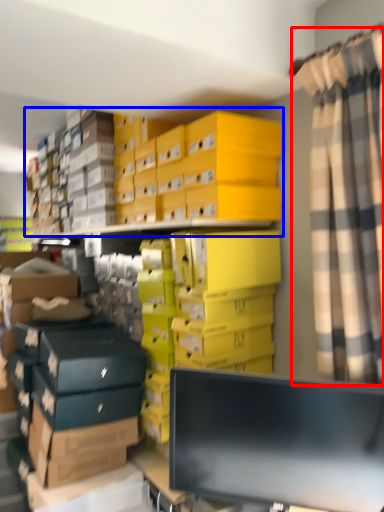
Question: Which object is closer to the camera taking this photo, curtain (highlighted by a red box) or storage box (highlighted by a blue box)?

Choices:
 (A) curtain
 (B) storage box

Answer: (A)